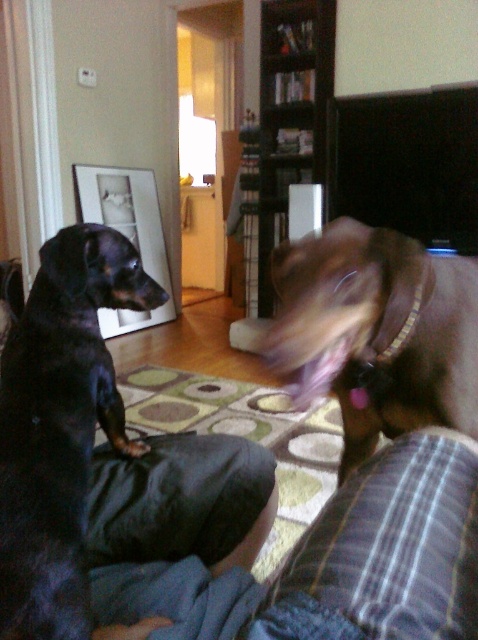
Is black smooth dog at left wider than brown smooth dog at center?

In fact, black smooth dog at left might be narrower than brown smooth dog at center.

Which of these two, black smooth dog at left or brown smooth dog at center, stands shorter?

brown smooth dog at center

The image size is (478, 640). What are the coordinates of `black smooth dog at left` in the screenshot? It's located at (60, 426).

I want to click on black smooth dog at left, so click(x=60, y=426).